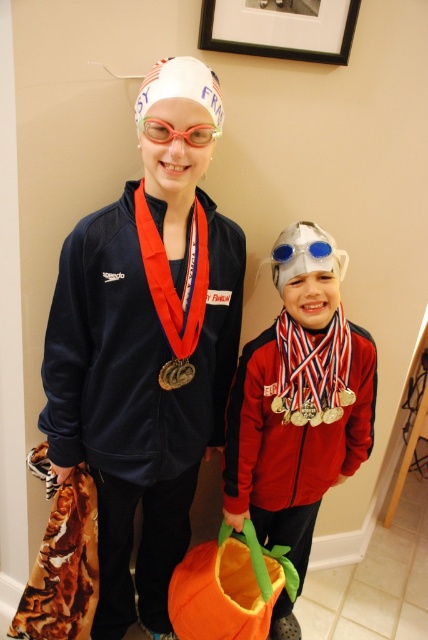
Question: Which object is positioned farthest from the blue rubber goggles at center?

Choices:
 (A) matte gold medal at center
 (B) gold metallic medal at center
 (C) shiny silver helmet at center
 (D) black matte picture frame at upper center

Answer: (D)

Question: Among these points, which one is farthest from the camera?

Choices:
 (A) (353, 403)
 (B) (180, 358)
 (C) (151, 182)

Answer: (A)

Question: Does navy blue fabric jacket at left have a lesser width compared to shiny silver helmet at center?

Choices:
 (A) yes
 (B) no

Answer: (B)

Question: Considering the relative positions of navy blue fabric jacket at left and shiny silver helmet at center in the image provided, where is navy blue fabric jacket at left located with respect to shiny silver helmet at center?

Choices:
 (A) left
 (B) right

Answer: (A)

Question: Is gold metallic medal at lower center positioned behind gold metallic medal at center?

Choices:
 (A) yes
 (B) no

Answer: (A)

Question: Which object is closer to the camera taking this photo?

Choices:
 (A) gold metallic medal at lower center
 (B) black matte picture frame at upper center

Answer: (B)